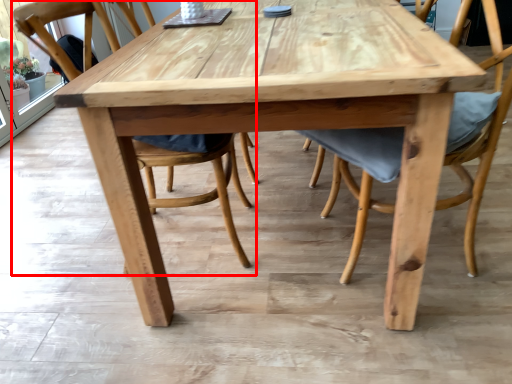
Question: From the image, what is the correct spatial relationship of chair (annotated by the red box) in relation to chair?

Choices:
 (A) right
 (B) left

Answer: (B)